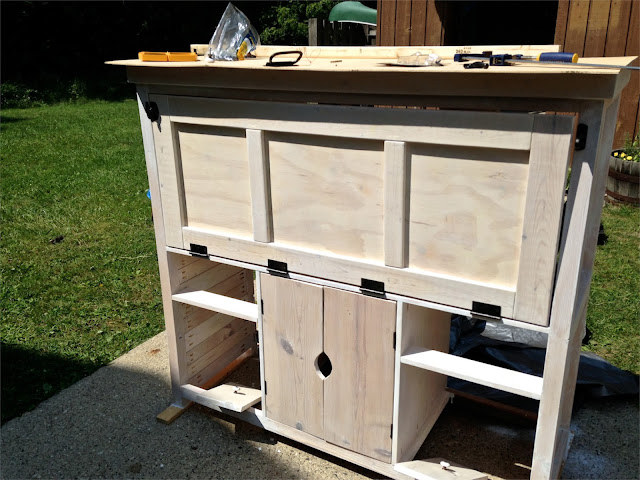
The height and width of the screenshot is (480, 640). In order to click on vertical planks in this screenshot , I will do `click(169, 179)`, `click(253, 176)`, `click(402, 180)`, `click(540, 211)`.